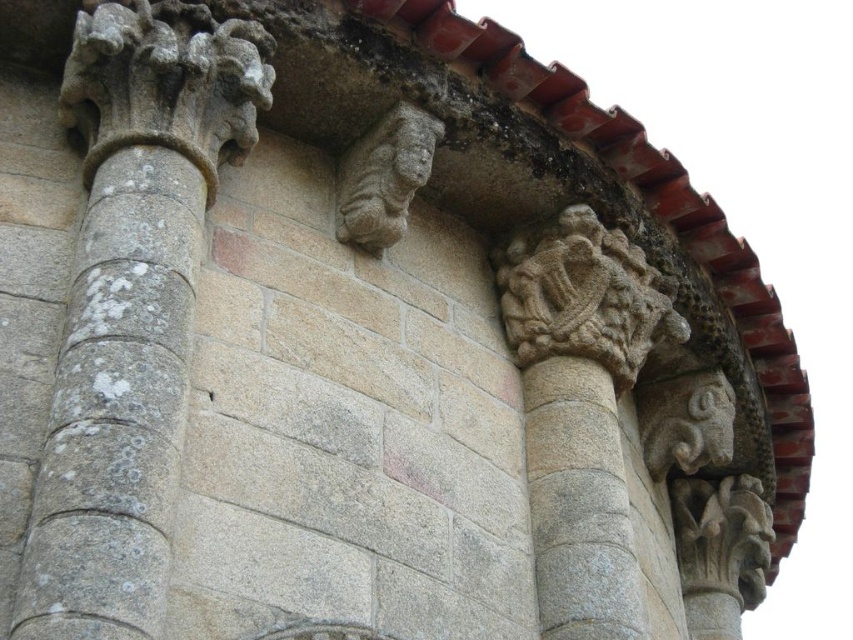
Which is below, gray stone column at center or carved stone lion at center?

gray stone column at center is below.

Does gray stone column at center have a lesser width compared to carved stone lion at center?

No.

Where is `gray stone column at center`? The height and width of the screenshot is (640, 853). gray stone column at center is located at coordinates (131, 307).

Locate an element on the screen. gray stone column at center is located at coordinates (131, 307).

Does gray stone column at center have a smaller size compared to smooth stone face at center?

Incorrect, gray stone column at center is not smaller in size than smooth stone face at center.

Between point (166, 428) and point (428, 163), which one is positioned in front?

Point (166, 428) is more forward.

Image resolution: width=853 pixels, height=640 pixels. Identify the location of gray stone column at center. (131, 307).

Which of these two, carved stone lion at center or smooth stone face at center, stands taller?

carved stone lion at center is taller.

Is carved stone lion at center to the left of smooth stone face at center from the viewer's perspective?

Indeed, carved stone lion at center is positioned on the left side of smooth stone face at center.

This screenshot has height=640, width=853. Find the location of `carved stone lion at center`. carved stone lion at center is located at coordinates (384, 177).

Locate an element on the screen. This screenshot has width=853, height=640. carved stone lion at center is located at coordinates (384, 177).